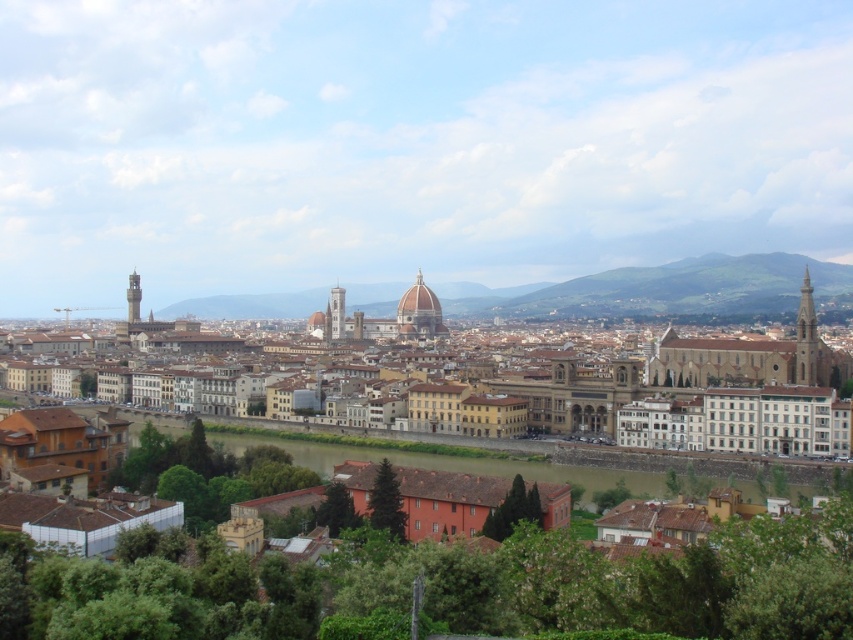
You are a tourist standing at the point marked by the coordinates point [706,388] in Florence. What can you see directly in front of you?

At point [706,388] lies brown stone buildings at center.